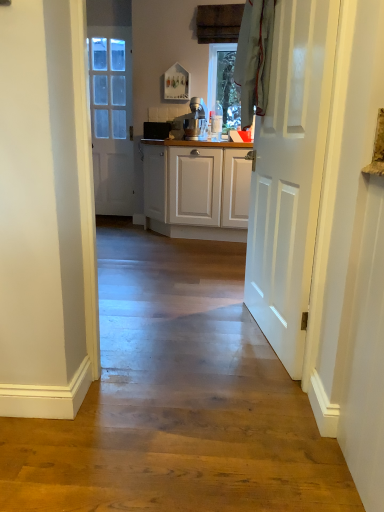
The width and height of the screenshot is (384, 512). Find the location of `free space to the left of white glossy door at center, acting as the 2th door starting from the back`. free space to the left of white glossy door at center, acting as the 2th door starting from the back is located at coordinates (193, 337).